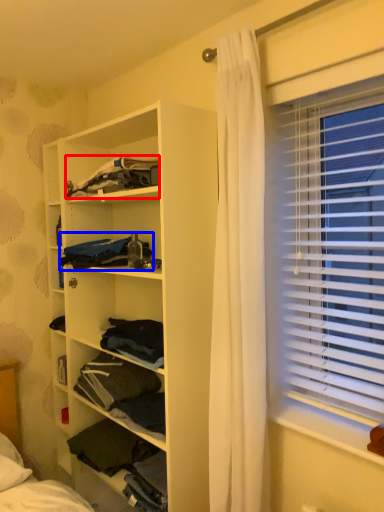
Question: Which point is further to the camera, clothing (highlighted by a red box) or clothing (highlighted by a blue box)?

Choices:
 (A) clothing
 (B) clothing

Answer: (B)